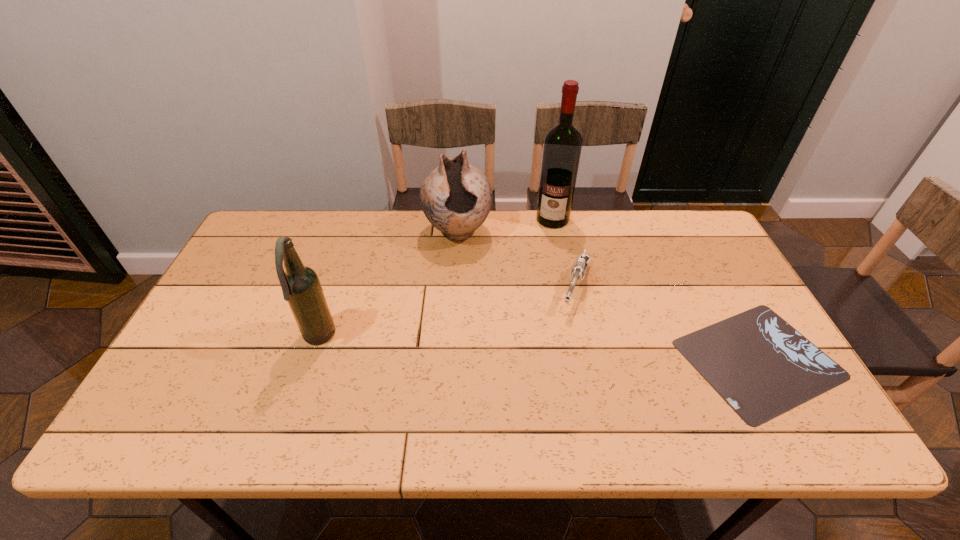
You are a GUI agent. You are given a task and a screenshot of the screen. Output one action in this format:
    pyautogui.click(x=<x>, y=<y>)
    Task: Click on the object that is at the right edge
    The image size is (960, 540).
    Given the screenshot: What is the action you would take?
    pyautogui.click(x=758, y=363)

You are a GUI agent. You are given a task and a screenshot of the screen. Output one action in this format:
    pyautogui.click(x=<x>, y=<y>)
    Task: Click on the object located at the near right corner
    Image resolution: width=960 pixels, height=540 pixels.
    Given the screenshot: What is the action you would take?
    pyautogui.click(x=758, y=363)

Image resolution: width=960 pixels, height=540 pixels. In the image, there is a desktop. In order to click on vacant space at the far edge in this screenshot , I will do `click(633, 224)`.

Image resolution: width=960 pixels, height=540 pixels. I want to click on blank space at the left edge of the desktop, so click(x=256, y=304).

What are the coordinates of `free space at the right edge of the desktop` in the screenshot? It's located at (682, 277).

The height and width of the screenshot is (540, 960). In order to click on vacant space at the far left corner of the desktop in this screenshot , I will do `click(255, 246)`.

You are a GUI agent. You are given a task and a screenshot of the screen. Output one action in this format:
    pyautogui.click(x=<x>, y=<y>)
    Task: Click on the empty space between the gun and the leftmost object
    Image resolution: width=960 pixels, height=540 pixels.
    Given the screenshot: What is the action you would take?
    pyautogui.click(x=447, y=313)

Locate an element on the screen. The width and height of the screenshot is (960, 540). vacant area that lies between the rightmost object and the second object from left to right is located at coordinates (608, 295).

This screenshot has height=540, width=960. In order to click on empty space between the pottery and the second shortest object in this screenshot , I will do `click(516, 260)`.

At what (x,y) coordinates should I click in order to perform the action: click on free area in between the rightmost object and the fourth tallest object. Please return your answer as a coordinate pair (x, y). This screenshot has height=540, width=960. Looking at the image, I should click on (667, 323).